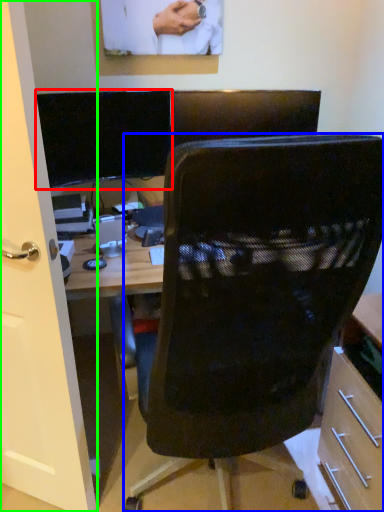
Question: Which is nearer to the computer monitor (highlighted by a red box)? chair (highlighted by a blue box) or glass door (highlighted by a green box).

Choices:
 (A) chair
 (B) glass door

Answer: (B)